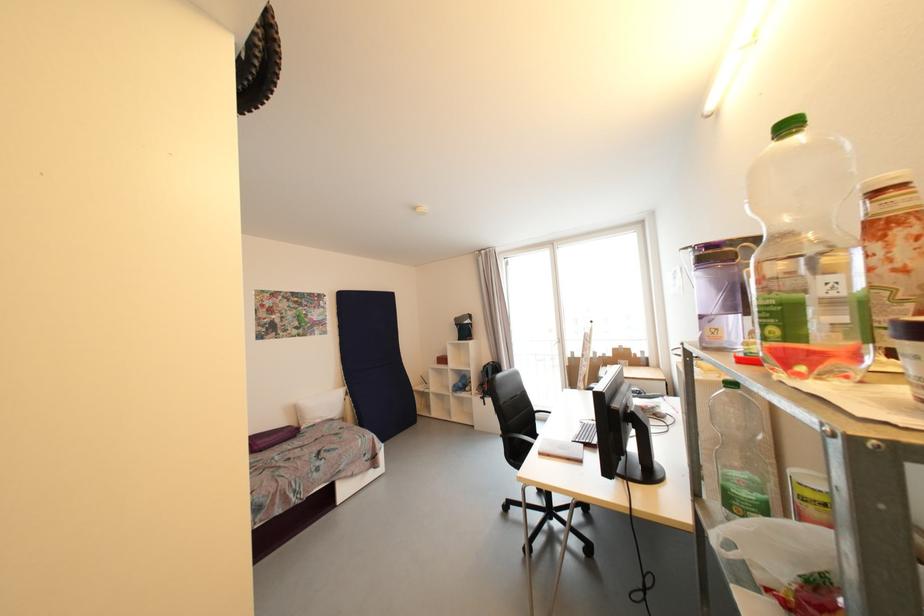
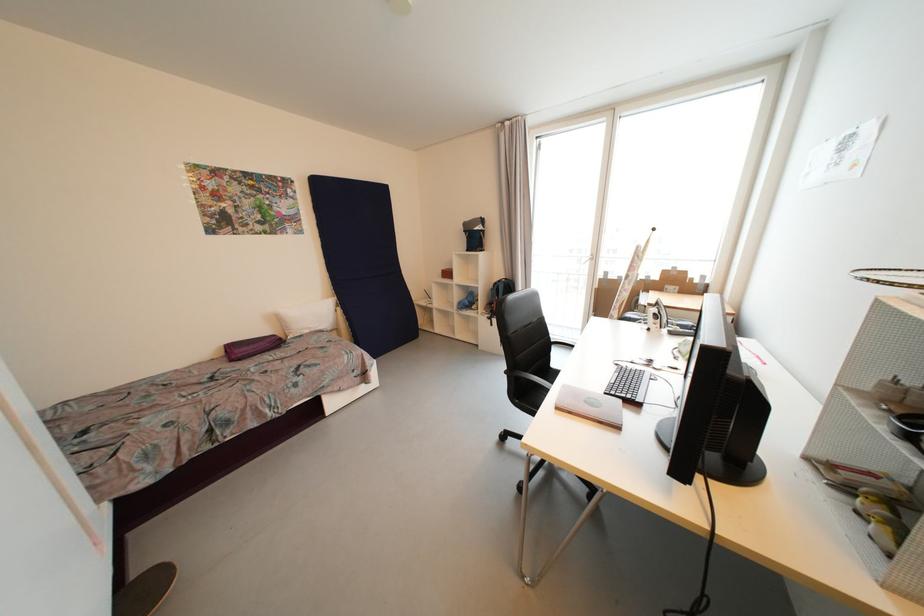
Question: Which direction would the cameraman need to move to produce the second image? Reply with the corresponding letter.

Choices:
 (A) Left
 (B) Right
 (C) Forward
 (D) Backward

Answer: (C)